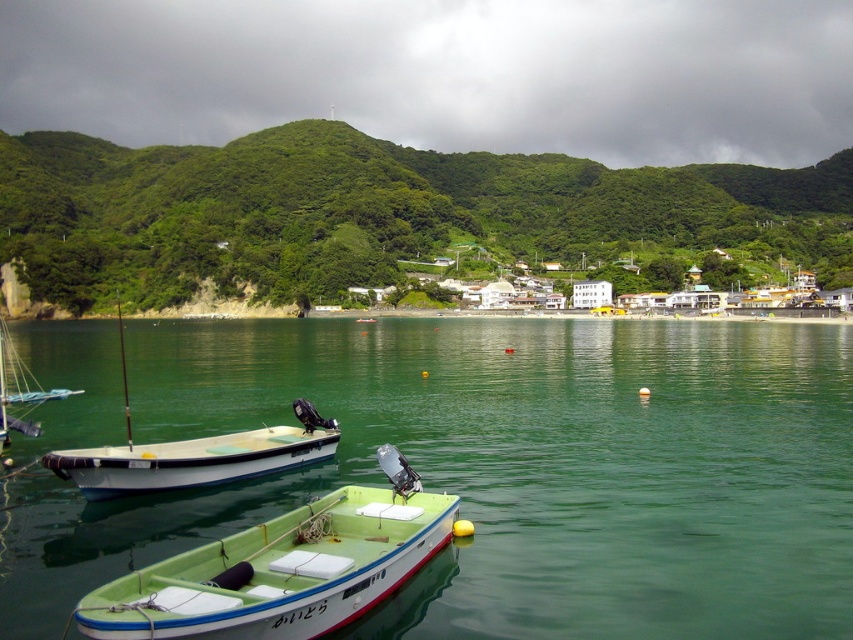
Is green smooth water at center above green leafy hillside at center?

No.

Can you confirm if green smooth water at center is thinner than green leafy hillside at center?

Indeed, green smooth water at center has a lesser width compared to green leafy hillside at center.

Who is more forward, (576, 595) or (497, 170)?

Point (576, 595) is more forward.

Locate an element on the screen. green smooth water at center is located at coordinates (503, 470).

Which is more to the right, green smooth water at center or white matte boat at center?

green smooth water at center is more to the right.

Is green smooth water at center positioned at the back of white matte boat at center?

No, it is in front of white matte boat at center.

Is point (676, 624) more distant than point (294, 444)?

No, (676, 624) is closer to viewer.

The width and height of the screenshot is (853, 640). In order to click on green smooth water at center in this screenshot , I will do `click(503, 470)`.

Is green smooth water at center to the right of green plastic boat at center from the viewer's perspective?

Incorrect, green smooth water at center is not on the right side of green plastic boat at center.

What do you see at coordinates (503, 470) in the screenshot? I see `green smooth water at center` at bounding box center [503, 470].

Locate an element on the screen. green smooth water at center is located at coordinates (503, 470).